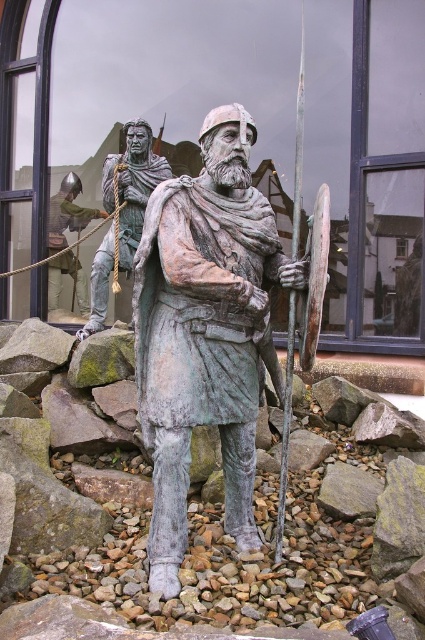
Question: Is green patina statue at center positioned behind green fabric rope at upper left?

Choices:
 (A) no
 (B) yes

Answer: (A)

Question: Which point is closer to the camera?

Choices:
 (A) green patina statue at center
 (B) bronze statue at center
 (C) green fabric rope at upper left

Answer: (B)

Question: Which point is closer to the camera taking this photo?

Choices:
 (A) (102, 266)
 (B) (255, 324)
 (C) (19, 168)
 (D) (67, 196)

Answer: (B)

Question: Is green patina statue at center positioned behind bronze statue at center?

Choices:
 (A) yes
 (B) no

Answer: (A)

Question: In this image, where is bronze statue at center located relative to bronze warrior at left?

Choices:
 (A) below
 (B) above

Answer: (A)

Question: Based on their relative distances, which object is nearer to the green patina statue at center?

Choices:
 (A) bronze statue at center
 (B) green fabric rope at upper left
 (C) bronze warrior at left

Answer: (C)